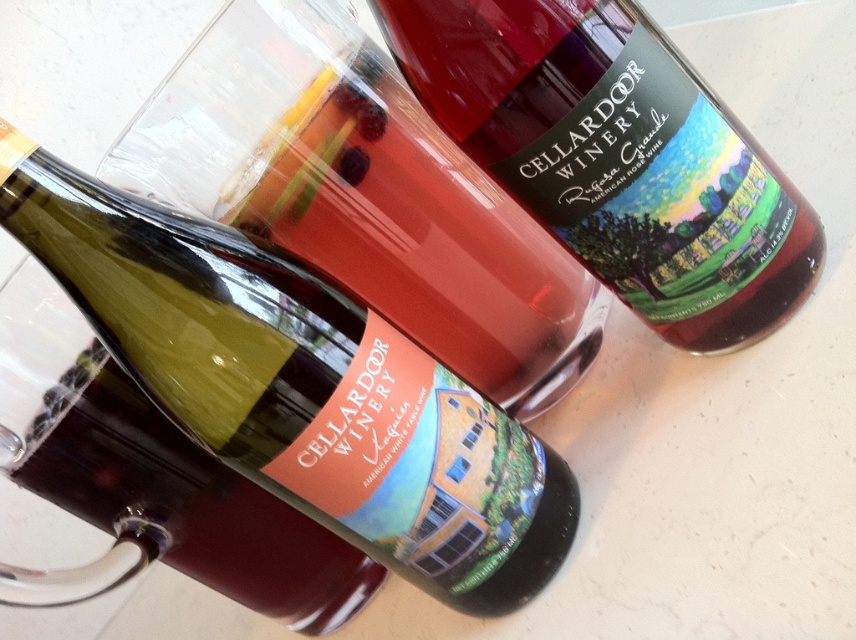
Describe the element at coordinates (301, 387) in the screenshot. The height and width of the screenshot is (640, 856). I see `matte glass bottle at center` at that location.

Is matte glass bottle at center to the left of translucent glass bottle at upper right from the viewer's perspective?

Yes, matte glass bottle at center is to the left of translucent glass bottle at upper right.

Who is more forward, (260, 452) or (705, 285)?

Positioned in front is point (260, 452).

At what (x,y) coordinates should I click in order to perform the action: click on matte glass bottle at center. Please return your answer as a coordinate pair (x, y). The image size is (856, 640). Looking at the image, I should click on (301, 387).